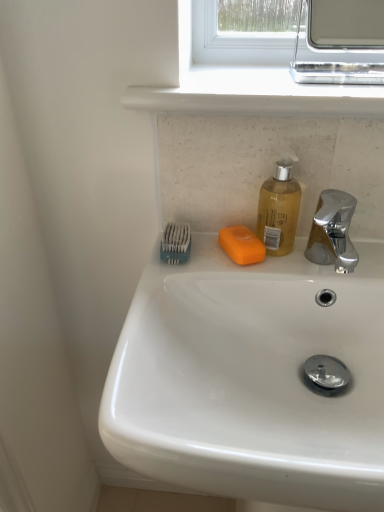
Question: Is orange matte soap at center smaller than white glossy sink at center?

Choices:
 (A) yes
 (B) no

Answer: (A)

Question: Is orange matte soap at center bigger than white glossy sink at center?

Choices:
 (A) no
 (B) yes

Answer: (A)

Question: Can you confirm if orange matte soap at center is shorter than white glossy sink at center?

Choices:
 (A) no
 (B) yes

Answer: (B)

Question: Considering the relative positions of orange matte soap at center and white glossy sink at center in the image provided, is orange matte soap at center to the right of white glossy sink at center from the viewer's perspective?

Choices:
 (A) no
 (B) yes

Answer: (A)

Question: Is orange matte soap at center facing away from white glossy sink at center?

Choices:
 (A) yes
 (B) no

Answer: (A)

Question: Is white glossy sink at center taller or shorter than chrome metallic medicine cabinet at upper right?

Choices:
 (A) tall
 (B) short

Answer: (A)

Question: Would you say white glossy sink at center is to the left or to the right of chrome metallic medicine cabinet at upper right in the picture?

Choices:
 (A) right
 (B) left

Answer: (B)

Question: Is white glossy sink at center inside or outside of chrome metallic medicine cabinet at upper right?

Choices:
 (A) inside
 (B) outside

Answer: (B)

Question: From a real-world perspective, is white glossy sink at center above or below chrome metallic medicine cabinet at upper right?

Choices:
 (A) above
 (B) below

Answer: (B)

Question: From a real-world perspective, relative to white smooth window sill at upper center, is orange matte soap at center vertically above or below?

Choices:
 (A) above
 (B) below

Answer: (B)

Question: Is orange matte soap at center inside or outside of white smooth window sill at upper center?

Choices:
 (A) outside
 (B) inside

Answer: (A)

Question: Is orange matte soap at center to the left or to the right of white smooth window sill at upper center in the image?

Choices:
 (A) right
 (B) left

Answer: (B)

Question: In terms of size, does orange matte soap at center appear bigger or smaller than white smooth window sill at upper center?

Choices:
 (A) big
 (B) small

Answer: (B)

Question: In terms of height, does white glossy sink at center look taller or shorter compared to blue plastic toothbrush at upper left?

Choices:
 (A) short
 (B) tall

Answer: (B)

Question: Relative to blue plastic toothbrush at upper left, is white glossy sink at center in front or behind?

Choices:
 (A) front
 (B) behind

Answer: (A)